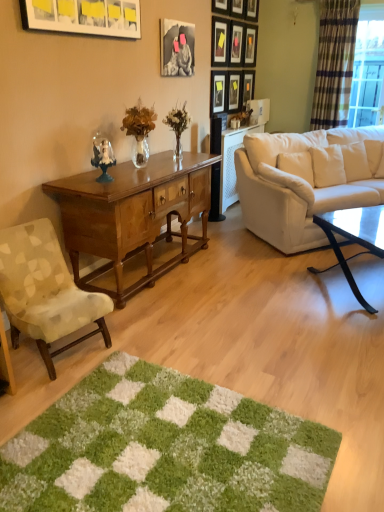
Question: Considering the relative sizes of plaid fabric curtain at right and wooden picture frame at upper center, the sixth picture frame positioned from the right, in the image provided, is plaid fabric curtain at right thinner than wooden picture frame at upper center, the sixth picture frame positioned from the right,?

Choices:
 (A) no
 (B) yes

Answer: (A)

Question: From the image's perspective, is plaid fabric curtain at right beneath wooden picture frame at upper center, the 6th picture frame in the left-to-right sequence?

Choices:
 (A) yes
 (B) no

Answer: (B)

Question: Does plaid fabric curtain at right have a greater width compared to wooden picture frame at upper center, the 6th picture frame in the left-to-right sequence?

Choices:
 (A) no
 (B) yes

Answer: (B)

Question: From the image's perspective, is plaid fabric curtain at right on top of wooden picture frame at upper center, the 6th picture frame in the left-to-right sequence?

Choices:
 (A) no
 (B) yes

Answer: (B)

Question: Can you confirm if plaid fabric curtain at right is bigger than wooden picture frame at upper center, the sixth picture frame positioned from the right?

Choices:
 (A) no
 (B) yes

Answer: (B)

Question: Is plaid fabric curtain at right closer to the viewer compared to wooden picture frame at upper center, the sixth picture frame positioned from the right?

Choices:
 (A) yes
 (B) no

Answer: (A)

Question: From the image's perspective, would you say plaid fabric curtain at right is positioned over wooden picture frame at upper center, which is the third picture frame from right to left?

Choices:
 (A) yes
 (B) no

Answer: (B)

Question: From a real-world perspective, is plaid fabric curtain at right positioned under wooden picture frame at upper center, placed as the ninth picture frame when sorted from left to right, based on gravity?

Choices:
 (A) yes
 (B) no

Answer: (A)

Question: Is plaid fabric curtain at right touching wooden picture frame at upper center, which is the third picture frame from right to left?

Choices:
 (A) no
 (B) yes

Answer: (A)

Question: Is plaid fabric curtain at right taller than wooden picture frame at upper center, placed as the ninth picture frame when sorted from left to right?

Choices:
 (A) no
 (B) yes

Answer: (B)

Question: Would you say plaid fabric curtain at right is outside wooden picture frame at upper center, placed as the ninth picture frame when sorted from left to right?

Choices:
 (A) yes
 (B) no

Answer: (A)

Question: Is the position of plaid fabric curtain at right more distant than that of wooden picture frame at upper center, which is the third picture frame from right to left?

Choices:
 (A) yes
 (B) no

Answer: (B)

Question: Does matte white picture frame at upper left, the 1th picture frame from the left, have a lesser height compared to wooden picture frame at upper center, the 8th picture frame when ordered from right to left?

Choices:
 (A) no
 (B) yes

Answer: (B)